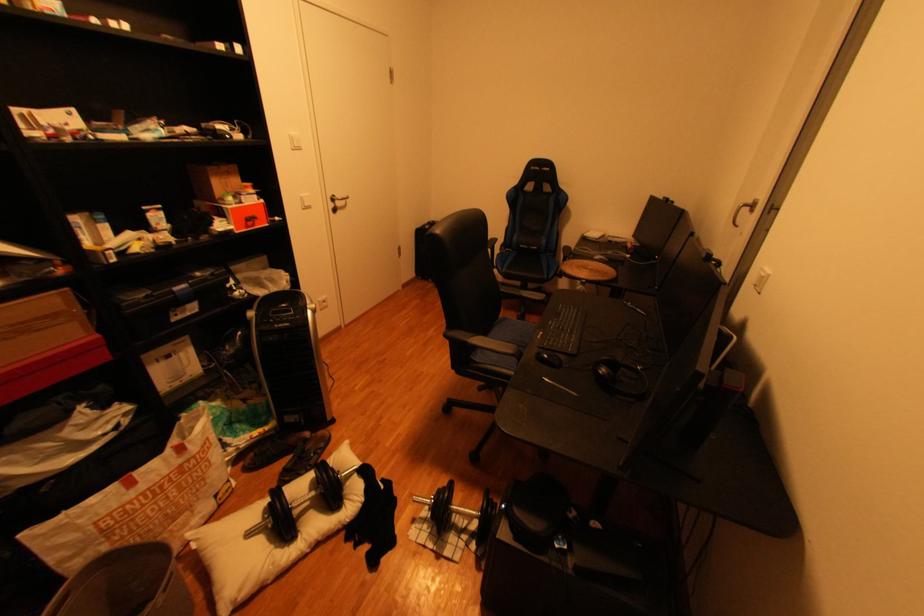
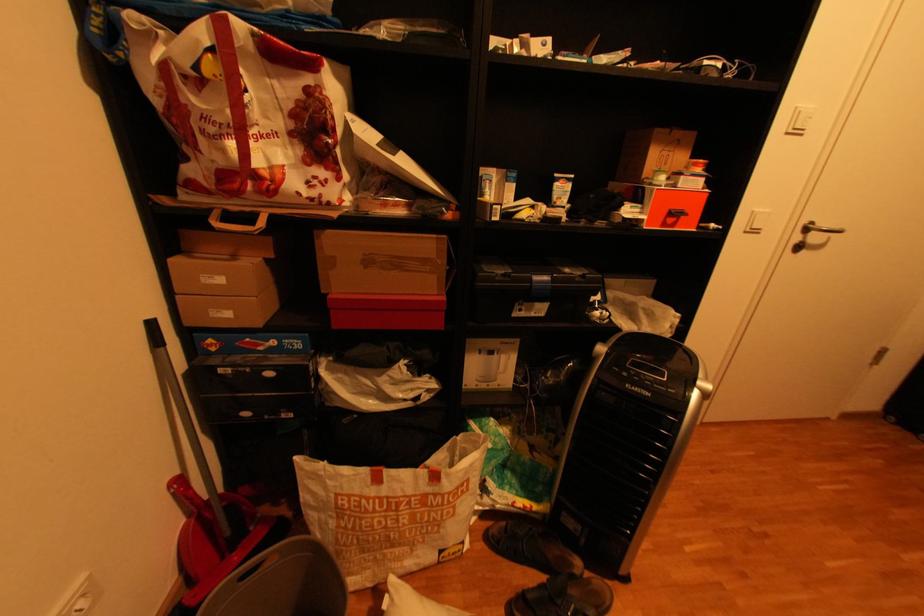
In the second image, find the point that corresponds to [257,188] in the first image.

(704, 166)